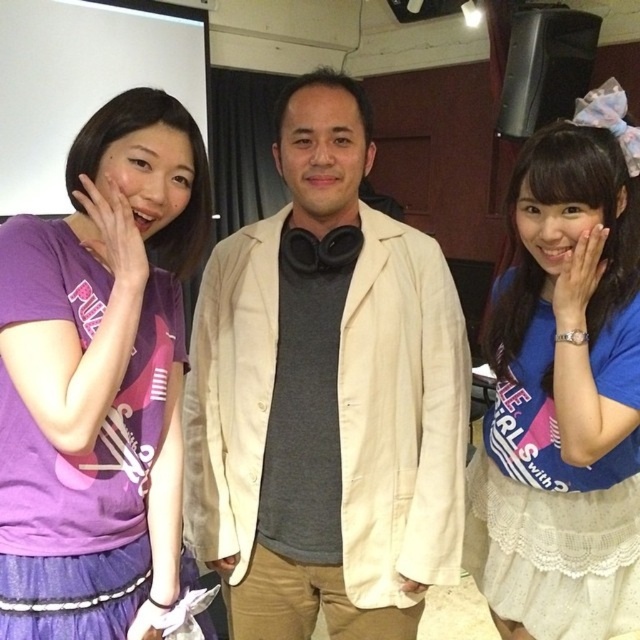
You are organizing a clothing display and need to arrange the beige fabric jacket at center and the blue fabric shirt at center in a specific order. According to their positions in the image, which one should be placed to the left of the other?

The beige fabric jacket at center should be placed to the left of the blue fabric shirt at center because in the image, the beige fabric jacket at center is positioned to the left of the blue fabric shirt at center.